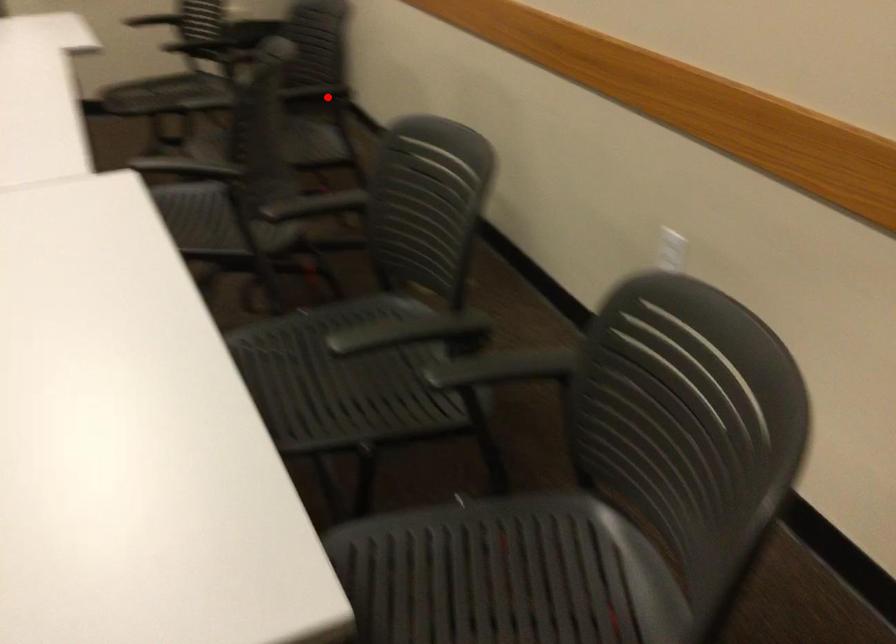
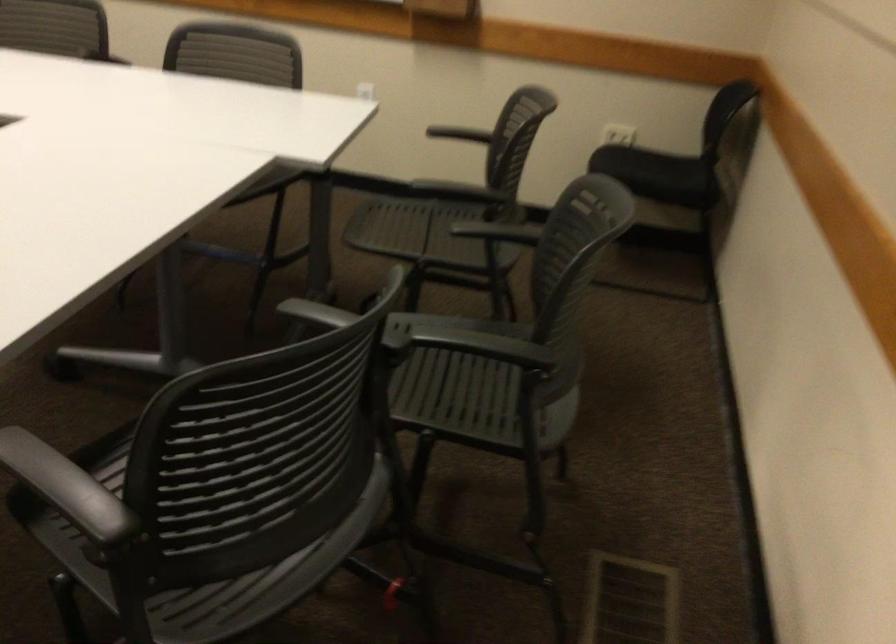
Where in the second image is the point corresponding to the highlighted location from the first image?

(504, 359)